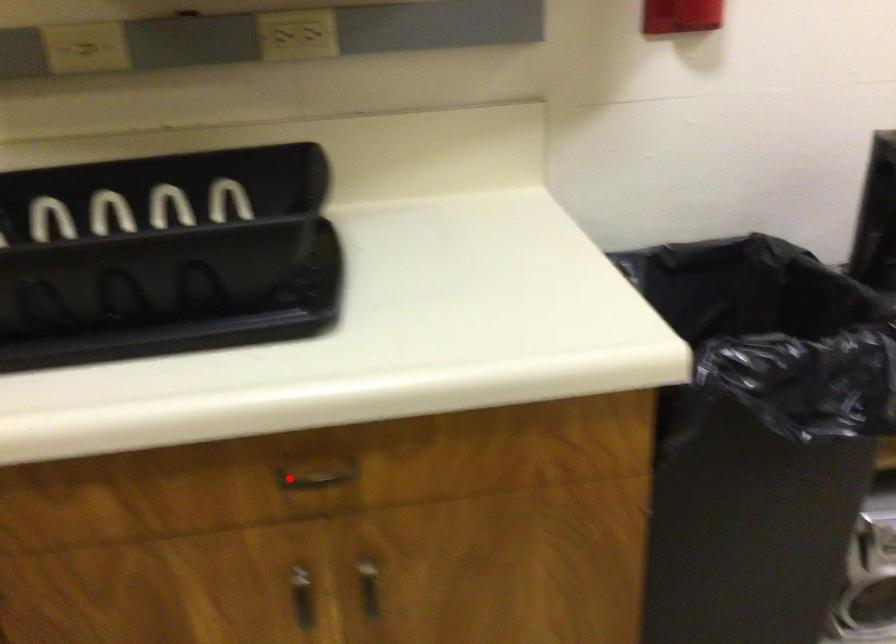
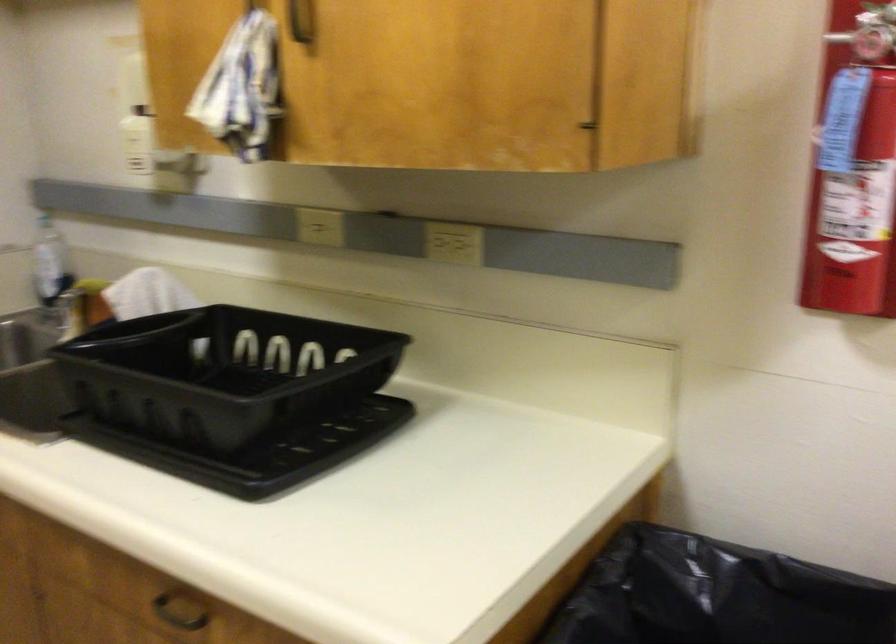
Question: I am providing you with two images of the same scene from different viewpoints. In image1, a red point is highlighted. Considering the same 3D point in image2, which of the following is correct?

Choices:
 (A) It is closer
 (B) It is farther

Answer: (B)